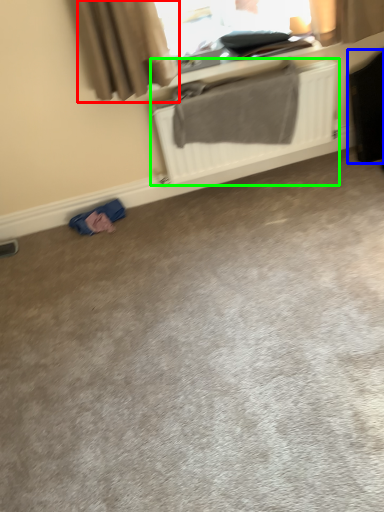
Question: Which object is the farthest from curtain (highlighted by a red box)? Choose among these: luggage (highlighted by a blue box) or radiator (highlighted by a green box).

Choices:
 (A) luggage
 (B) radiator

Answer: (A)